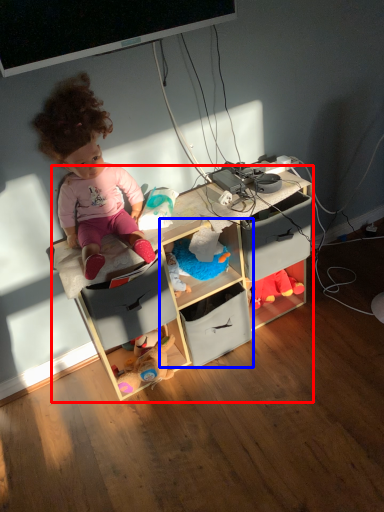
Question: Which object is further to the camera taking this photo, shelf (highlighted by a red box) or shelf (highlighted by a blue box)?

Choices:
 (A) shelf
 (B) shelf

Answer: (B)